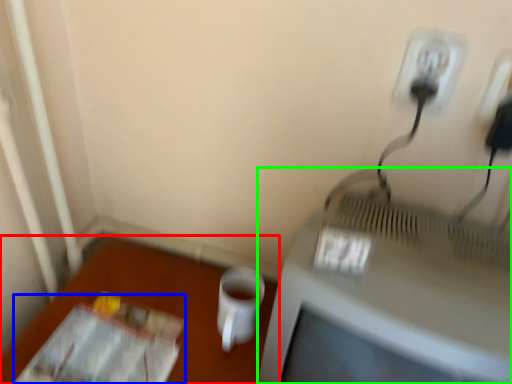
Question: Based on their relative distances, which object is nearer to table (highlighted by a red box)? Choose from magazine (highlighted by a blue box) and television (highlighted by a green box).

Choices:
 (A) magazine
 (B) television

Answer: (A)